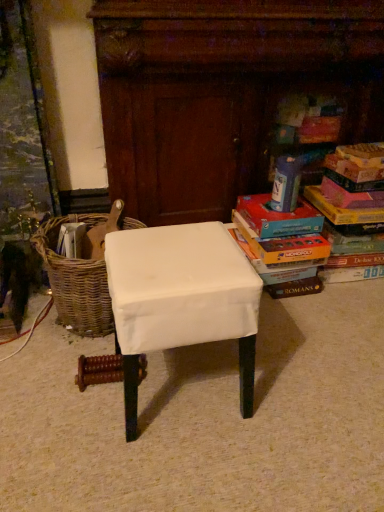
Locate an element on the screen. The width and height of the screenshot is (384, 512). free location in front of matte cardboard book at right, the first book positioned from the left is located at coordinates (304, 323).